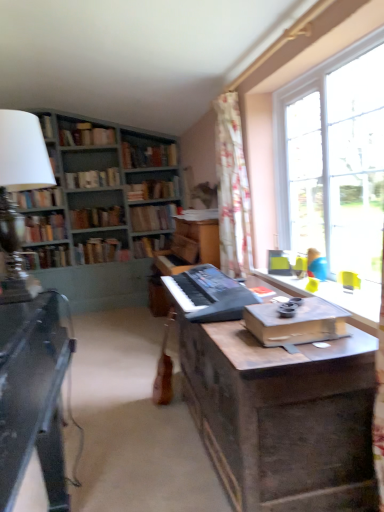
Where is `hardcover book at left, arranged as the 5th book when viewed from the top`? hardcover book at left, arranged as the 5th book when viewed from the top is located at coordinates (37, 198).

Locate an element on the screen. This screenshot has width=384, height=512. hardcover book at center-left, positioned as the fifth book in bottom-to-top order is located at coordinates pos(97,217).

Describe the element at coordinates (151, 245) in the screenshot. The height and width of the screenshot is (512, 384). I see `wooden bookshelf at center, marked as the third book in a bottom-to-top arrangement` at that location.

Where is `hardcover book at upper center, marked as the second book in a top-to-bottom arrangement`? The height and width of the screenshot is (512, 384). hardcover book at upper center, marked as the second book in a top-to-bottom arrangement is located at coordinates (148, 155).

Describe the element at coordinates (148, 155) in the screenshot. This screenshot has width=384, height=512. I see `hardcover book at upper center, marked as the second book in a top-to-bottom arrangement` at that location.

At what (x,y) coordinates should I click in order to perform the action: click on hardcover books at upper left, which ranks as the 1th book in top-to-bottom order. Please return your answer as a coordinate pair (x, y). The image size is (384, 512). Looking at the image, I should click on (86, 135).

You are a GUI agent. You are given a task and a screenshot of the screen. Output one action in this format:
    pyautogui.click(x=<x>, y=<y>)
    Task: Click on the hardcover book at left, placed as the seventh book when sorted from bottom to top
    The width and height of the screenshot is (384, 512).
    Given the screenshot: What is the action you would take?
    pyautogui.click(x=37, y=198)

Choose the correct answer: Is hardcover book at upper center, marked as the second book in a top-to-bottom arrangement, inside wooden bookshelf at left or outside it?

hardcover book at upper center, marked as the second book in a top-to-bottom arrangement, lies outside wooden bookshelf at left.

Is hardcover book at upper center, marked as the second book in a top-to-bottom arrangement, oriented away from wooden bookshelf at left?

No.

Is point (137, 152) positioned before point (11, 149)?

No, (137, 152) is behind (11, 149).

Between hardcover book at upper center, marked as the second book in a top-to-bottom arrangement, and wooden bookshelf at left, which one appears on the right side from the viewer's perspective?

hardcover book at upper center, marked as the second book in a top-to-bottom arrangement, is more to the right.

Can you confirm if hardcover book at center, which is counted as the eighth book, starting from the bottom, is taller than hardcover book at left, the 1th book positioned from the bottom?

No, hardcover book at center, which is counted as the eighth book, starting from the bottom, is not taller than hardcover book at left, the 1th book positioned from the bottom.

Looking at this image, from a real-world perspective, is hardcover book at center, arranged as the fourth book when viewed from the top, on hardcover book at left, the 1th book positioned from the bottom?

Yes.

Which of these two, hardcover book at center, arranged as the fourth book when viewed from the top, or hardcover book at left, which is counted as the eleventh book, starting from the top, is wider?

hardcover book at center, arranged as the fourth book when viewed from the top, is wider.

Is hardcover book at center, arranged as the fourth book when viewed from the top, facing towards hardcover book at left, the 1th book positioned from the bottom?

No, hardcover book at center, arranged as the fourth book when viewed from the top, is not facing towards hardcover book at left, the 1th book positioned from the bottom.

Is hardcover book at upper center, the tenth book when ordered from bottom to top, surrounded by hardcover book at center-left, positioned as the second book in bottom-to-top order?

No, hardcover book at upper center, the tenth book when ordered from bottom to top, is located outside of hardcover book at center-left, positioned as the second book in bottom-to-top order.

From the picture: Which object is closer to the camera, hardcover book at center-left, the 10th book in the top-to-bottom sequence, or hardcover book at upper center, the tenth book when ordered from bottom to top?

hardcover book at upper center, the tenth book when ordered from bottom to top, is more forward.

Could you measure the distance between hardcover book at center-left, the 10th book in the top-to-bottom sequence, and hardcover book at upper center, marked as the second book in a top-to-bottom arrangement?

hardcover book at center-left, the 10th book in the top-to-bottom sequence, and hardcover book at upper center, marked as the second book in a top-to-bottom arrangement, are 1.13 meters apart from each other.

From the image's perspective, does hardcover book at upper center, marked as the second book in a top-to-bottom arrangement, appear higher than black matte keyboard at center?

Indeed, from the image's perspective, hardcover book at upper center, marked as the second book in a top-to-bottom arrangement, is shown above black matte keyboard at center.

In the scene shown: From a real-world perspective, is hardcover book at upper center, the tenth book when ordered from bottom to top, beneath black matte keyboard at center?

Actually, hardcover book at upper center, the tenth book when ordered from bottom to top, is physically above black matte keyboard at center in the real world.

Is point (135, 165) positioned before point (198, 284)?

That is False.

From the picture: How many degrees apart are the facing directions of hardcover book at upper center, marked as the second book in a top-to-bottom arrangement, and black matte keyboard at center?

The angle between the facing direction of hardcover book at upper center, marked as the second book in a top-to-bottom arrangement, and the facing direction of black matte keyboard at center is 91.1 degrees.

Which of these two, wooden bookshelf at left or black matte keyboard at center, is bigger?

Bigger between the two is wooden bookshelf at left.

Is wooden bookshelf at left turned away from black matte keyboard at center?

wooden bookshelf at left does not have its back to black matte keyboard at center.

Find the location of a particular element. Image resolution: width=384 pixels, height=512 pixels. shelf above the black matte keyboard at center (from a real-world perspective) is located at coordinates (20, 176).

Is point (17, 126) more distant than point (204, 320)?

No, it is in front of (204, 320).

Is hardcover books at upper left, which ranks as the 1th book in top-to-bottom order, behind hardcover book at left, which is counted as the eleventh book, starting from the top?

No, hardcover books at upper left, which ranks as the 1th book in top-to-bottom order, is closer to the viewer.

Is hardcover books at upper left, which ranks as the 1th book in top-to-bottom order, facing towards hardcover book at left, which is counted as the eleventh book, starting from the top?

No.

From the image's perspective, between hardcover books at upper left, which ranks as the 1th book in top-to-bottom order, and hardcover book at left, the 1th book positioned from the bottom, which one is located above?

hardcover books at upper left, which ranks as the 1th book in top-to-bottom order.

Is hardcover books at upper left, which ranks as the 1th book in top-to-bottom order, spatially inside hardcover book at left, which is counted as the eleventh book, starting from the top, or outside of it?

hardcover books at upper left, which ranks as the 1th book in top-to-bottom order, is spatially situated outside hardcover book at left, which is counted as the eleventh book, starting from the top.

From the image's perspective, does green painted wood bookcase at upper left appear lower than hardcover book at center-left, the seventh book from the top?

No, from the image's perspective, green painted wood bookcase at upper left is not beneath hardcover book at center-left, the seventh book from the top.

Is green painted wood bookcase at upper left not inside hardcover book at center-left, positioned as the fifth book in bottom-to-top order?

Indeed, green painted wood bookcase at upper left is completely outside hardcover book at center-left, positioned as the fifth book in bottom-to-top order.

Between point (77, 120) and point (84, 213), which one is positioned behind?

The point (77, 120) is farther.

From a real-world perspective, is green painted wood bookcase at upper left physically located above or below hardcover book at center-left, the seventh book from the top?

green painted wood bookcase at upper left is above hardcover book at center-left, the seventh book from the top.

Where is `the 7th book above the wooden bookshelf at left (from the image's perspective)`? The width and height of the screenshot is (384, 512). the 7th book above the wooden bookshelf at left (from the image's perspective) is located at coordinates (148, 155).

Identify the location of the 7th book counting from the right side of the hardcover book at left, which is counted as the eleventh book, starting from the top. The width and height of the screenshot is (384, 512). pos(154,189).

Which object lies nearer to the anchor point wooden bookshelf at center, marked as the third book in a bottom-to-top arrangement, hardcover book at left, the 1th book positioned from the bottom, or green painted wood bookcase at upper left?

green painted wood bookcase at upper left lies closer to wooden bookshelf at center, marked as the third book in a bottom-to-top arrangement, than the other object.

Based on their spatial positions, is hardcover books at upper left, which ranks as the 1th book in top-to-bottom order, or hardcover book at center-left, positioned as the second book in bottom-to-top order, further from hardcover book at left, positioned as the 4th book in bottom-to-top order?

hardcover books at upper left, which ranks as the 1th book in top-to-bottom order, lies further to hardcover book at left, positioned as the 4th book in bottom-to-top order, than the other object.

Considering their positions, is wooden bookshelf at center, acting as the ninth book starting from the top, positioned closer to hardcover book at left, the 1th book positioned from the bottom, than floral fabric curtain at upper right?

The object closer to hardcover book at left, the 1th book positioned from the bottom, is wooden bookshelf at center, acting as the ninth book starting from the top.

Considering their positions, is wooden desk at center positioned closer to hardcover book at center, which is counted as the eighth book, starting from the bottom, than black matte keyboard at center?

black matte keyboard at center.

Which object lies nearer to the anchor point hardcover book at center, which is the sixth book in top-to-bottom order, hardcover book at left, placed as the seventh book when sorted from bottom to top, or wooden bookshelf at left?

hardcover book at left, placed as the seventh book when sorted from bottom to top, is closer to hardcover book at center, which is the sixth book in top-to-bottom order.

Estimate the real-world distances between objects in this image. Which object is closer to hardcover book at left, the 1th book positioned from the bottom, black matte keyboard at center or floral fabric curtain at upper right?

Among the two, floral fabric curtain at upper right is located nearer to hardcover book at left, the 1th book positioned from the bottom.

Based on their spatial positions, is hardcover book at left, arranged as the 5th book when viewed from the top, or black matte keyboard at center closer to hardcover book at upper center, the tenth book when ordered from bottom to top?

Based on the image, hardcover book at left, arranged as the 5th book when viewed from the top, appears to be nearer to hardcover book at upper center, the tenth book when ordered from bottom to top.

Looking at the image, which one is located closer to hardcover book at center-left, positioned as the fifth book in bottom-to-top order, clear glass window at upper right or black matte keyboard at center?

Based on the image, black matte keyboard at center appears to be nearer to hardcover book at center-left, positioned as the fifth book in bottom-to-top order.

Locate an element on the screen. curtain located between wooden bookshelf at left and green painted wood bookcase at upper left in the depth direction is located at coordinates (232, 189).

What are the coordinates of `musical keyboard between wooden desk at center and hardcover book at upper center, the tenth book when ordered from bottom to top, in the front-back direction` in the screenshot? It's located at (209, 294).

Identify the location of musical keyboard located between wooden bookshelf at left and clear glass window at upper right in the left-right direction. (209, 294).

Locate an element on the screen. This screenshot has height=512, width=384. curtain between black matte keyboard at center and hardcover books at upper left, acting as the 11th book starting from the bottom, from front to back is located at coordinates (232, 189).